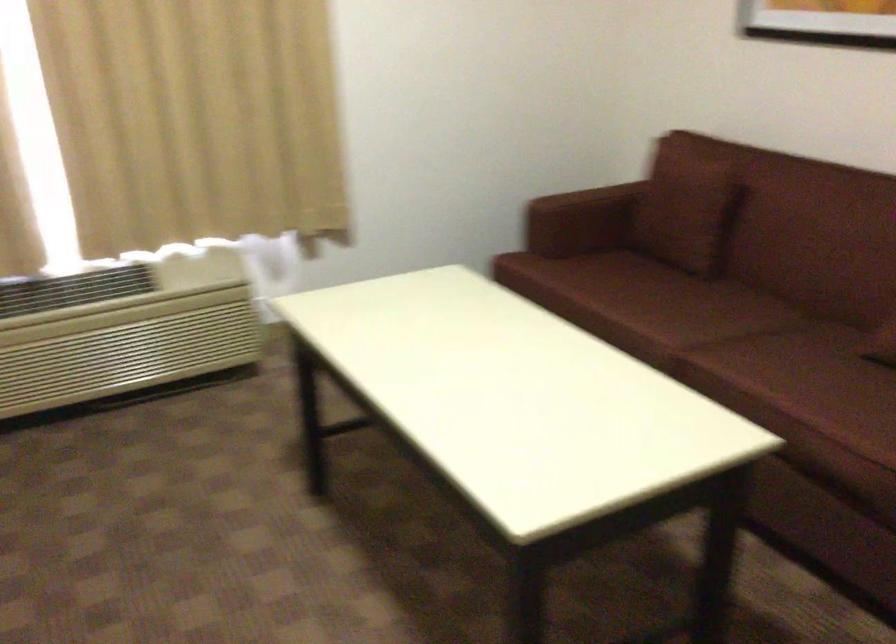
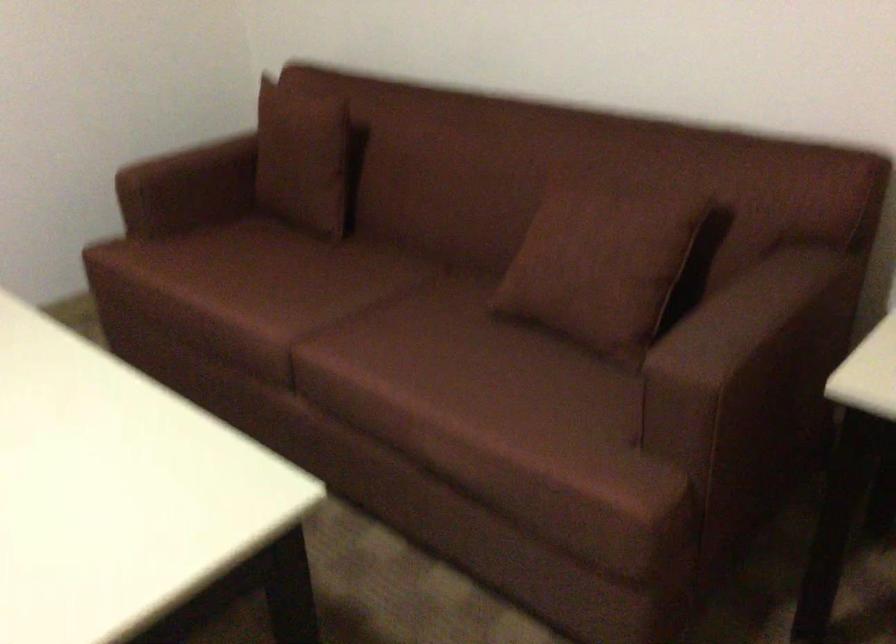
The point at (x=617, y=202) is marked in the first image. Where is the corresponding point in the second image?

(246, 165)